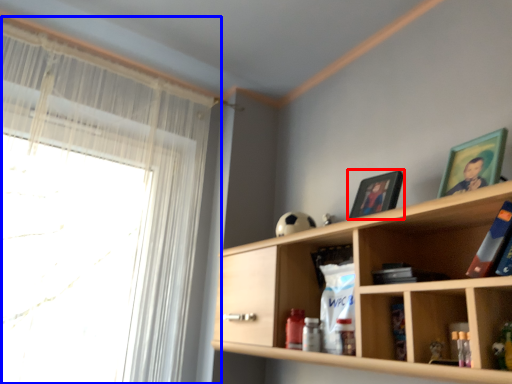
Question: Which of the following is the closest to the observer, picture frame (highlighted by a red box) or window (highlighted by a blue box)?

Choices:
 (A) picture frame
 (B) window

Answer: (A)